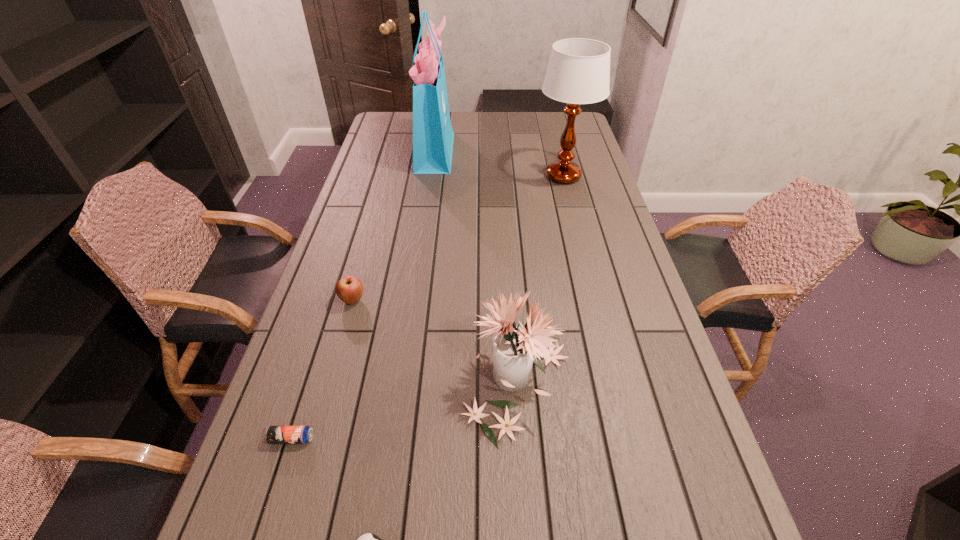
Locate an element on the screen. The width and height of the screenshot is (960, 540). vacant area that lies between the bouquet and the shopping bag is located at coordinates (476, 268).

Image resolution: width=960 pixels, height=540 pixels. In order to click on vacant space that's between the table lamp and the fourth nearest object in this screenshot , I will do (458, 238).

Where is `vacant space in between the bouquet and the table lamp`? Image resolution: width=960 pixels, height=540 pixels. vacant space in between the bouquet and the table lamp is located at coordinates (540, 281).

Locate an element on the screen. object that is the second closest one to the beer can is located at coordinates (515, 349).

I want to click on object that is the fifth closest one to the table lamp, so click(x=368, y=539).

Where is `free point that satisfies the following two spatial constraints: 1. on the front side of the shopping bag; 2. on the left side of the table lamp`? The height and width of the screenshot is (540, 960). free point that satisfies the following two spatial constraints: 1. on the front side of the shopping bag; 2. on the left side of the table lamp is located at coordinates (431, 176).

At what (x,y) coordinates should I click in order to perform the action: click on free space that satisfies the following two spatial constraints: 1. on the back side of the apple; 2. on the right side of the beer can. Please return your answer as a coordinate pair (x, y). This screenshot has width=960, height=540. Looking at the image, I should click on (336, 300).

Image resolution: width=960 pixels, height=540 pixels. I want to click on vacant space that satisfies the following two spatial constraints: 1. on the front side of the table lamp; 2. on the right side of the shopping bag, so click(x=431, y=176).

Find the location of a particular element. The height and width of the screenshot is (540, 960). vacant region that satisfies the following two spatial constraints: 1. on the back side of the third farthest object; 2. on the left side of the beer can is located at coordinates (336, 300).

Where is `vacant space that satisfies the following two spatial constraints: 1. on the back side of the beer can; 2. on the left side of the table lamp`? The image size is (960, 540). vacant space that satisfies the following two spatial constraints: 1. on the back side of the beer can; 2. on the left side of the table lamp is located at coordinates (376, 176).